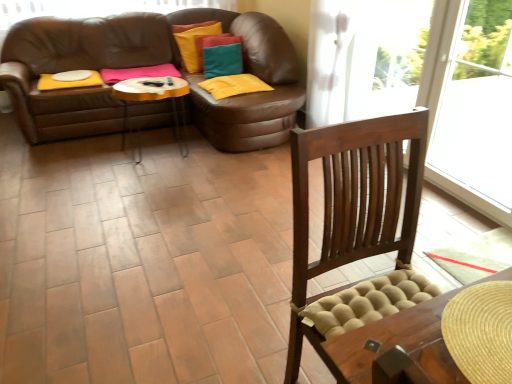
Question: Is brown leather footrest at center smaller than brown leather couch at upper left?

Choices:
 (A) no
 (B) yes

Answer: (B)

Question: Is brown leather footrest at center not near brown leather couch at upper left?

Choices:
 (A) no
 (B) yes

Answer: (A)

Question: Can you confirm if brown leather footrest at center is wider than brown leather couch at upper left?

Choices:
 (A) yes
 (B) no

Answer: (B)

Question: Is brown leather footrest at center shorter than brown leather couch at upper left?

Choices:
 (A) no
 (B) yes

Answer: (B)

Question: Is brown leather footrest at center to the left of brown leather couch at upper left from the viewer's perspective?

Choices:
 (A) no
 (B) yes

Answer: (A)

Question: Is brown leather footrest at center closer to the viewer compared to brown leather couch at upper left?

Choices:
 (A) yes
 (B) no

Answer: (A)

Question: Can you confirm if brown leather couch at upper left is shorter than brown leather footrest at center?

Choices:
 (A) no
 (B) yes

Answer: (A)

Question: Is brown leather couch at upper left oriented towards brown leather footrest at center?

Choices:
 (A) yes
 (B) no

Answer: (A)

Question: From the image's perspective, is brown leather couch at upper left located above brown leather footrest at center?

Choices:
 (A) no
 (B) yes

Answer: (B)

Question: Is brown leather couch at upper left to the right of brown leather footrest at center from the viewer's perspective?

Choices:
 (A) yes
 (B) no

Answer: (B)

Question: Is brown leather footrest at center located within brown leather couch at upper left?

Choices:
 (A) no
 (B) yes

Answer: (A)

Question: Is brown leather couch at upper left turned away from brown leather footrest at center?

Choices:
 (A) no
 (B) yes

Answer: (A)

Question: Based on their sizes in the image, would you say brown leather couch at upper left is bigger or smaller than brown leather footrest at center?

Choices:
 (A) small
 (B) big

Answer: (B)